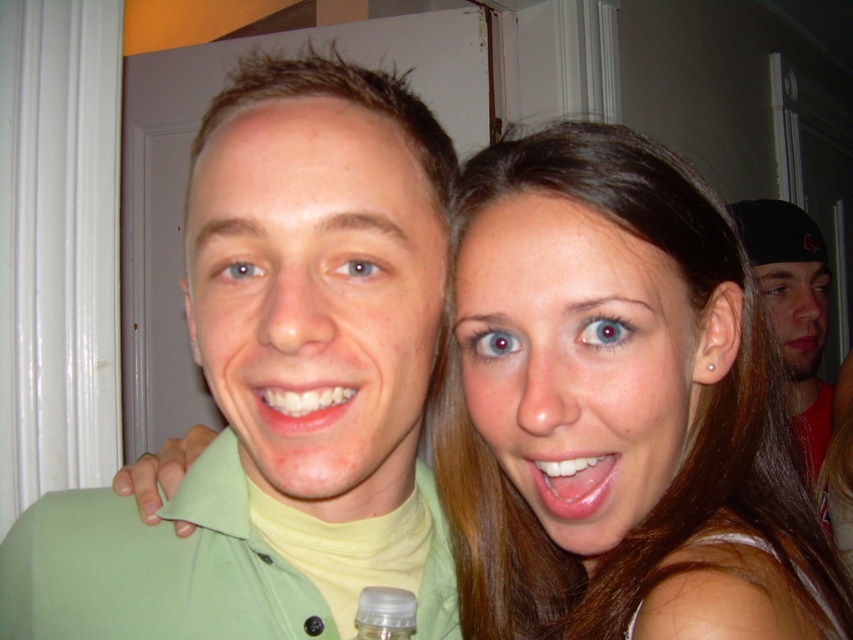
Looking at the scene with the smooth skin face at center and the transparent plastic bottle at lower center, which object is positioned to the left?

The transparent plastic bottle at lower center is positioned to the left of the smooth skin face at center.

You are a photographer trying to capture a candid shot of the two people in the scene. You want to ensure that both the smooth skin face at center and the transparent plastic bottle at lower center are in focus. Given that your camera can only focus on objects within a 5 inch range, will you be able to achieve this?

The smooth skin face at center and transparent plastic bottle at lower center are 6.57 inches apart from each other. Since the camera can only focus on objects within a 5 inch range, the distance between them exceeds the focus range, so you cannot have both in focus simultaneously.

You are a photographer adjusting the framing of a photo. You notice the black matte cap at right and the glossy white teeth at center in your viewfinder. Which object should you focus on to ensure it fits entirely within a 10cm wide section of your frame?

The glossy white teeth at center should be focused on because the black matte cap at right is wider than the glossy white teeth at center, so the teeth will fit better within the 10cm section.